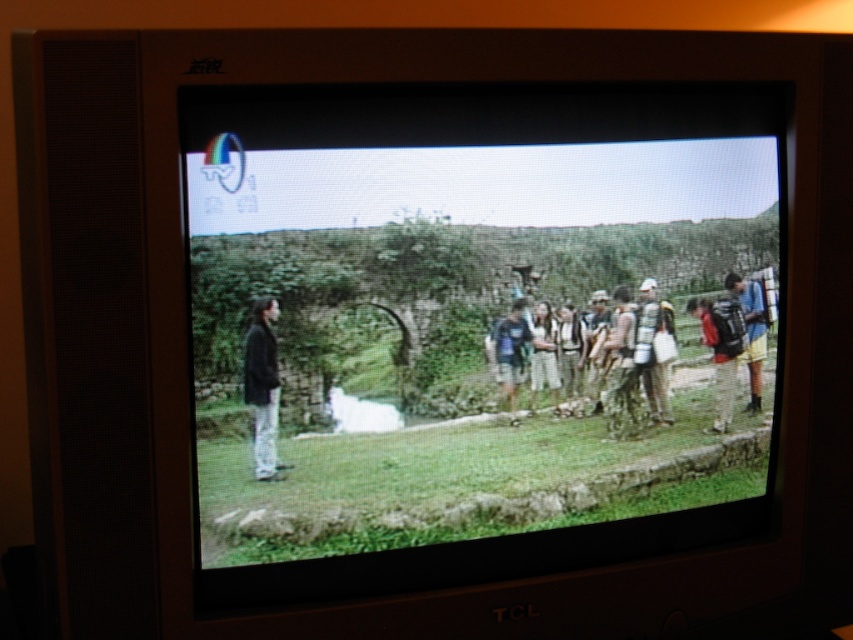
Question: Is the position of camouflage fabric backpack at right less distant than that of light brown leather jacket at center?

Choices:
 (A) no
 (B) yes

Answer: (A)

Question: Is dark gray jacket at left above dark blue fabric backpack at center?

Choices:
 (A) yes
 (B) no

Answer: (B)

Question: Which object appears farthest from the camera in this image?

Choices:
 (A) light brown leather jacket at center
 (B) dark gray jacket at left
 (C) camouflage fabric backpack at center-right
 (D) dark blue fabric backpack at center

Answer: (C)

Question: Which object is closer to the camera taking this photo?

Choices:
 (A) light brown leather jacket at center
 (B) green grass at center
 (C) camouflage fabric backpack at right
 (D) camouflage fabric backpack at center-right

Answer: (B)

Question: Estimate the real-world distances between objects in this image. Which object is closer to the camouflage fabric backpack at center-right?

Choices:
 (A) light brown leather jacket at center
 (B) green grass at center

Answer: (A)

Question: Can you confirm if camouflage fabric backpack at center-right is positioned above light brown leather jacket at center?

Choices:
 (A) yes
 (B) no

Answer: (B)